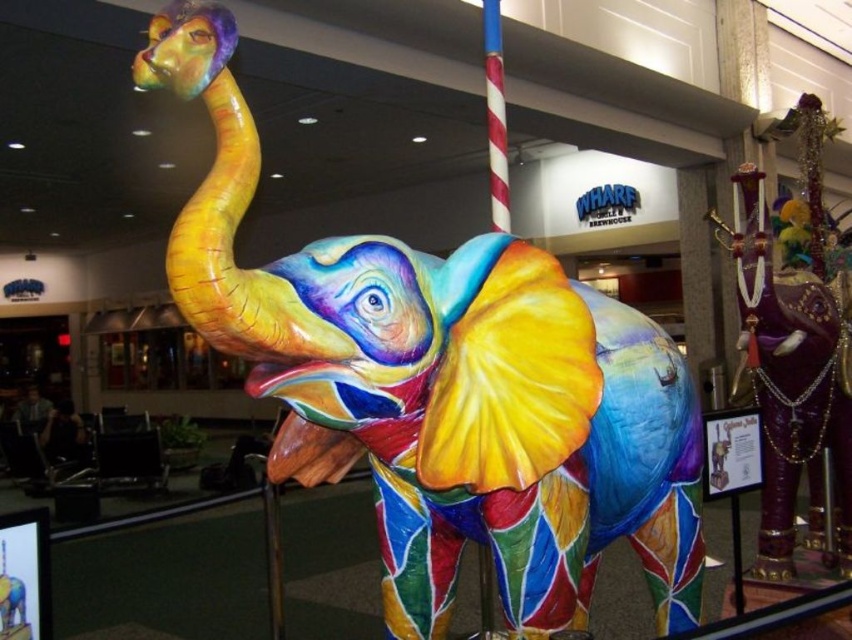
You are an interior designer planning to place a new decorative item between the multicolored painted elephant at center and the shiny purple elephant at right. Considering their sizes, which elephant should the new item be placed closer to for balance?

The multicolored painted elephant at center has a smaller size compared to the shiny purple elephant at right. To achieve balance, the new decorative item should be placed closer to the larger shiny purple elephant at right so that the visual weight is evenly distributed.

You are standing in front of the vibrant elephant sculpture and see two points marked in the image. The first point is at coordinates point (763, 556) and the second is at point (494, 152). Which point is closer to you?

Point (494, 152) is closer to you because point (763, 556) is behind it.

You are an art curator planning to photograph the multicolored painted elephant at center and the red and white striped pole at center. Since you want to capture both objects clearly in the photo, which one should you focus on first to ensure the other remains in the background?

You should focus on the multicolored painted elephant at center first because it is in front of the red and white striped pole at center, so if you focus on the elephant, the pole will naturally appear in the background.